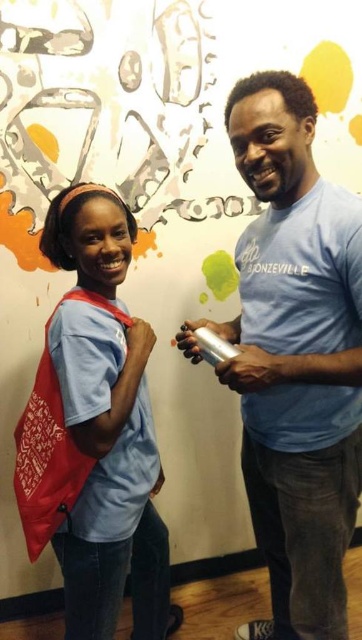
Based on the photo, you are taking a photo of the scene and want to ensure both the metallic canister at right and the matte blue shirt at center are clearly visible. Which object should you position closer to the center of your camera frame to achieve this?

To ensure both the metallic canister at right and the matte blue shirt at center are clearly visible, position the matte blue shirt at center closer to the center of your camera frame since it is already at the center and the metallic canister at right is to its right.

You are standing in the room and want to place a new poster on the wall where the metallic canister at right is located. What are the coordinates of the point where you should place the poster?

The coordinates for the metallic canister at right are at point (295, 356), so you should place the poster at those coordinates.

You are organizing a small event and need to place a metallic canister at right and a matte blue shirt at center on a shelf. Which object should you place first to ensure they fit properly?

The metallic canister at right has a larger size compared to the matte blue shirt at center, so you should place the metallic canister at right first to ensure they both fit on the shelf.